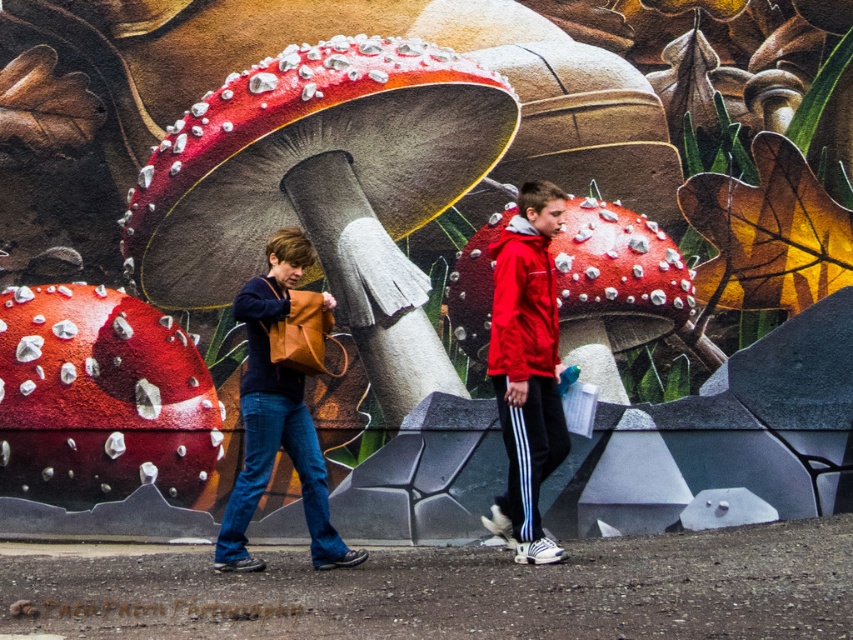
Question: Does red matte jacket at center appear on the left side of matte red jacket at center?

Choices:
 (A) yes
 (B) no

Answer: (B)

Question: Which object is positioned farthest from the red matte jacket at center?

Choices:
 (A) matte red jacket at center
 (B) matte brown leather bag at left
 (C) matte brown leather bag at center-left

Answer: (C)

Question: Does red matte jacket at center have a smaller size compared to matte red jacket at center?

Choices:
 (A) no
 (B) yes

Answer: (A)

Question: Which of the following is the farthest from the observer?

Choices:
 (A) matte red jacket at center
 (B) matte brown leather bag at center-left

Answer: (B)

Question: Is matte brown leather bag at left closer to camera compared to red matte jacket at center?

Choices:
 (A) yes
 (B) no

Answer: (B)

Question: Which point is closer to the camera taking this photo?

Choices:
 (A) (517, 256)
 (B) (546, 264)
 (C) (265, 296)

Answer: (A)